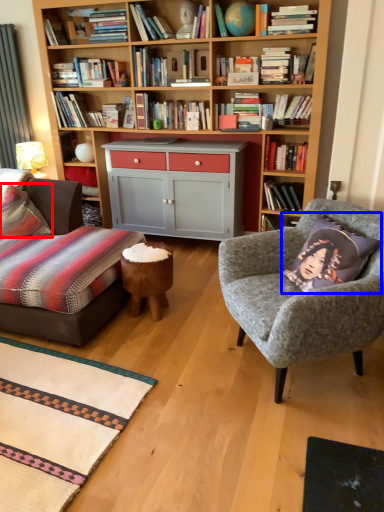
Question: Which of the following is the farthest to the observer, pillow (highlighted by a red box) or throw pillow (highlighted by a blue box)?

Choices:
 (A) pillow
 (B) throw pillow

Answer: (A)